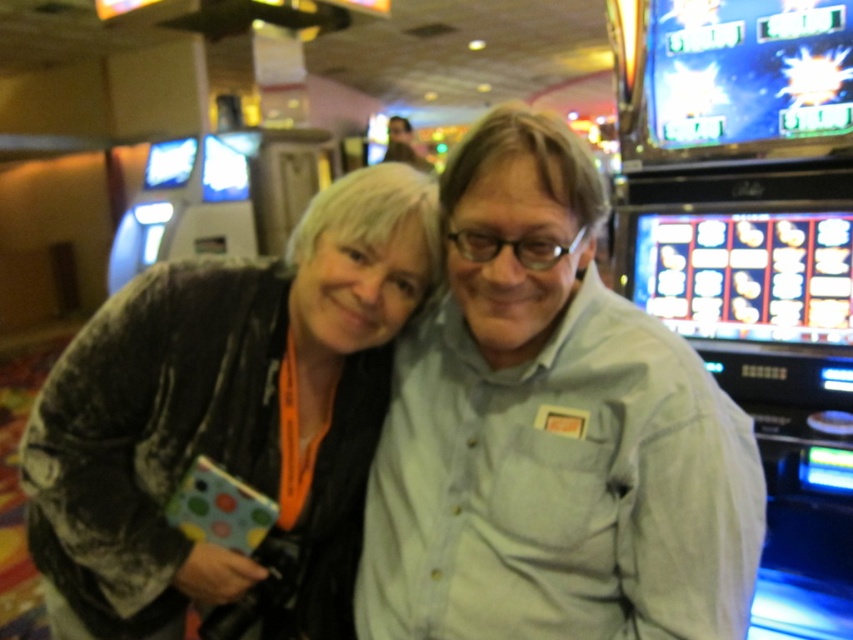
Question: Does light gray button-up shirt at center appear on the right side of fuzzy gray coat at center?

Choices:
 (A) no
 (B) yes

Answer: (B)

Question: Does light gray button-up shirt at center appear on the right side of fuzzy gray coat at center?

Choices:
 (A) yes
 (B) no

Answer: (A)

Question: Which point appears farthest from the camera in this image?

Choices:
 (A) (53, 369)
 (B) (662, 461)

Answer: (A)

Question: Which object is closer to the camera taking this photo?

Choices:
 (A) fuzzy gray coat at center
 (B) light gray button-up shirt at center

Answer: (B)

Question: Does light gray button-up shirt at center appear on the left side of fuzzy gray coat at center?

Choices:
 (A) yes
 (B) no

Answer: (B)